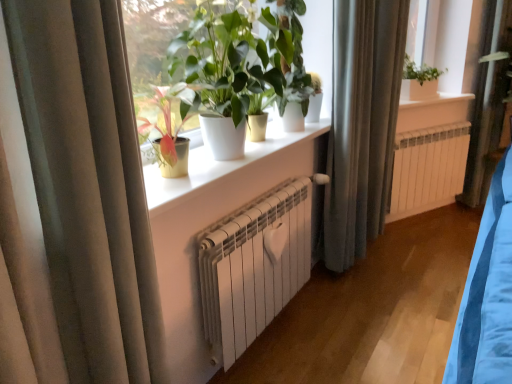
This screenshot has width=512, height=384. In order to click on blank area beneath white metallic radiator at center (from a real-world perspective) in this screenshot , I will do `click(417, 224)`.